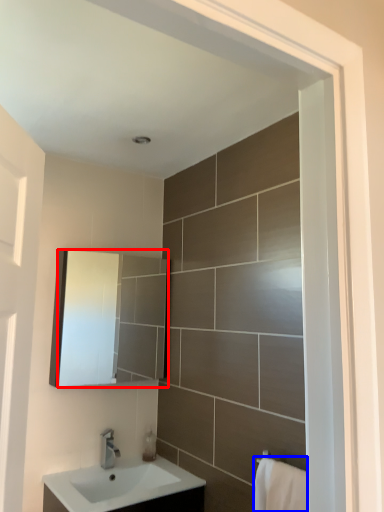
Question: Which object is closer to the camera taking this photo, mirror (highlighted by a red box) or bath towel (highlighted by a blue box)?

Choices:
 (A) mirror
 (B) bath towel

Answer: (B)